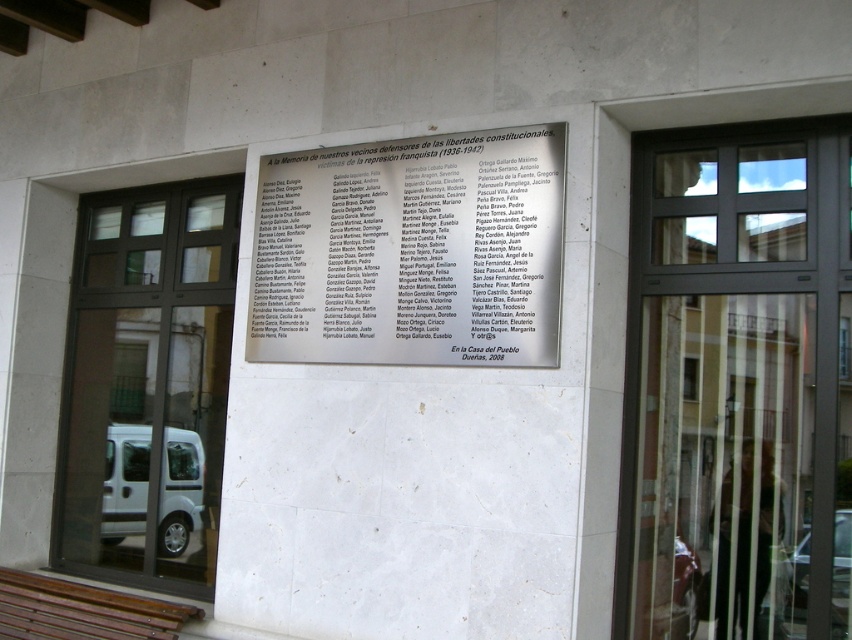
Question: Is metallic glass door at center positioned at the back of brown wooden bench at lower left?

Choices:
 (A) no
 (B) yes

Answer: (A)

Question: Which point appears farthest from the camera in this image?

Choices:
 (A) (89, 483)
 (B) (509, 289)

Answer: (A)

Question: Which object is farther from the camera taking this photo?

Choices:
 (A) black glass door at center
 (B) metallic glass door at center
 (C) brown wooden bench at lower left

Answer: (A)

Question: Which point is farther from the camera taking this photo?

Choices:
 (A) (640, 541)
 (B) (202, 440)
 (C) (530, 269)
 (D) (41, 588)

Answer: (B)

Question: Does white paper at center have a smaller size compared to brown wooden bench at lower left?

Choices:
 (A) yes
 (B) no

Answer: (B)

Question: Does white paper at center appear under brown wooden bench at lower left?

Choices:
 (A) yes
 (B) no

Answer: (B)